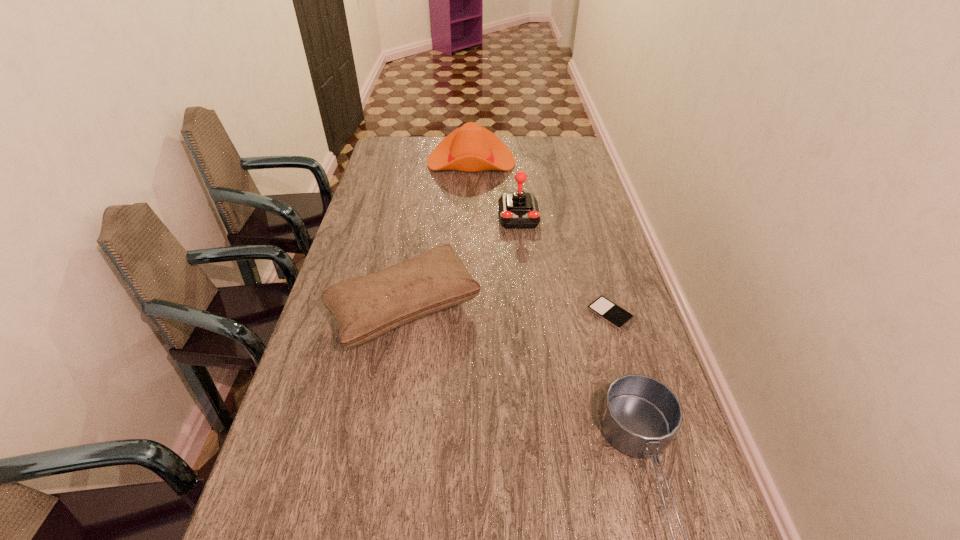
Where is `object that is at the right edge`? The image size is (960, 540). object that is at the right edge is located at coordinates (604, 308).

Find the location of `vacant area at the far edge`. vacant area at the far edge is located at coordinates (421, 159).

In the image, there is a desktop. At what (x,y) coordinates should I click in order to perform the action: click on free space at the left edge. Please return your answer as a coordinate pair (x, y). This screenshot has height=540, width=960. Looking at the image, I should click on (354, 239).

You are a GUI agent. You are given a task and a screenshot of the screen. Output one action in this format:
    pyautogui.click(x=<x>, y=<y>)
    Task: Click on the vacant space at the right edge
    
    Given the screenshot: What is the action you would take?
    pyautogui.click(x=583, y=232)

Find the location of a particular element. This screenshot has width=960, height=540. vacant area at the far left corner is located at coordinates (386, 147).

This screenshot has width=960, height=540. Identify the location of unoccupied position between the iPod and the cowboy hat. (540, 238).

At what (x,y) coordinates should I click in order to perform the action: click on vacant area that lies between the farthest object and the joystick. Please return your answer as a coordinate pair (x, y). The image size is (960, 540). Looking at the image, I should click on point(495,189).

Locate an element on the screen. vacant area that lies between the cowboy hat and the joystick is located at coordinates (495, 189).

This screenshot has width=960, height=540. Identify the location of vacant point located between the shortest object and the cushion. (507, 310).

At what (x,y) coordinates should I click in order to perform the action: click on empty space between the cowboy hat and the iPod. Please return your answer as a coordinate pair (x, y). This screenshot has height=540, width=960. Looking at the image, I should click on (540, 238).